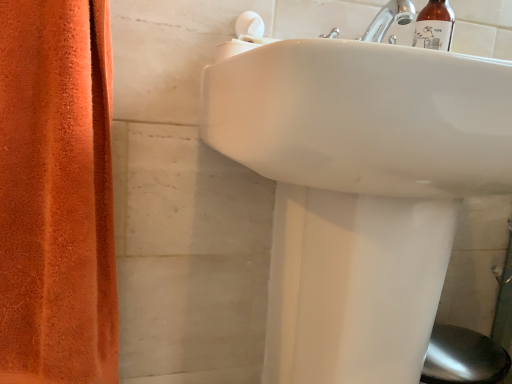
In order to click on white glossy sink at center in this screenshot , I will do `click(358, 188)`.

This screenshot has width=512, height=384. Describe the element at coordinates (358, 188) in the screenshot. I see `white glossy sink at center` at that location.

What is the approximate height of white glossy sink at center?

27.28 inches.

Where is `white glossy sink at center`? white glossy sink at center is located at coordinates (358, 188).